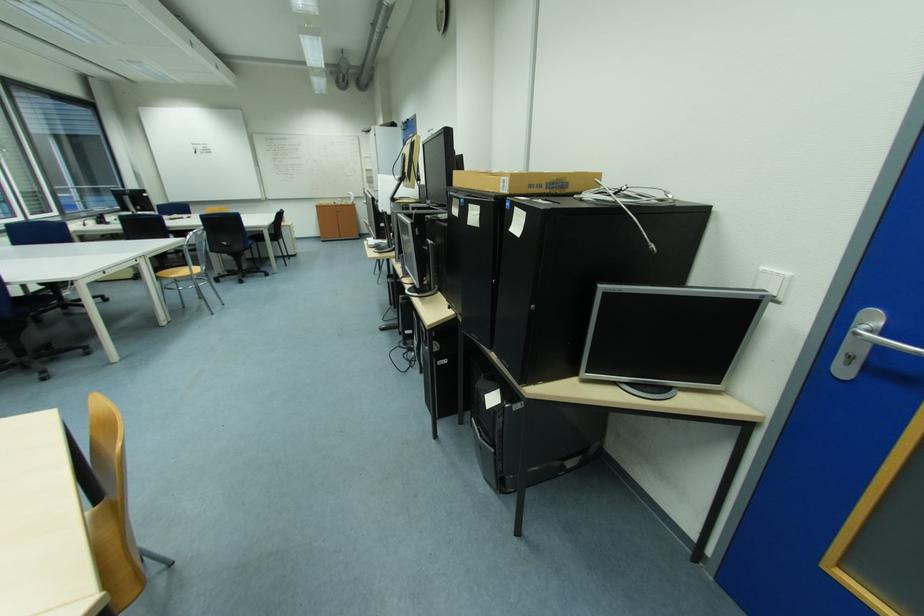
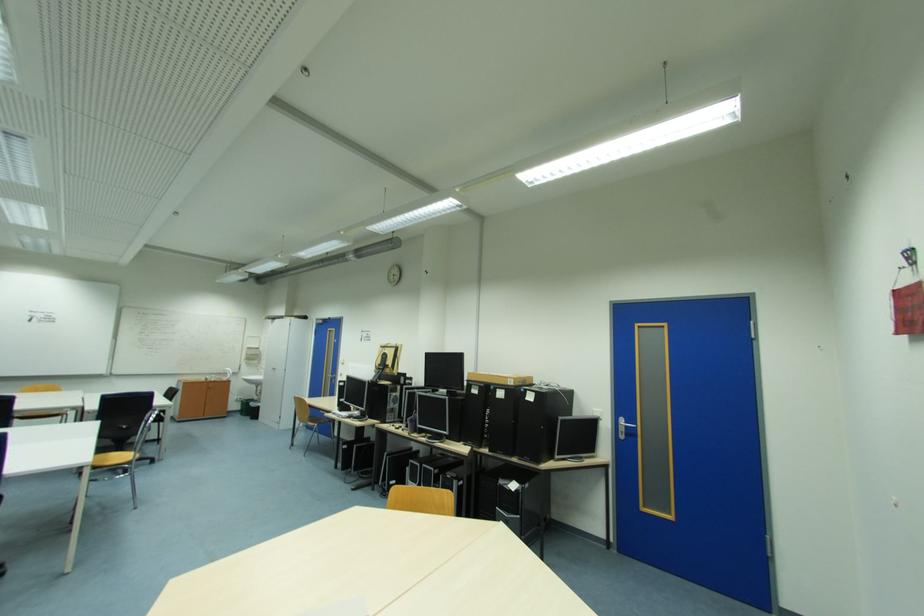
Locate, in the second image, the point that corresponds to point (878, 342) in the first image.

(630, 426)